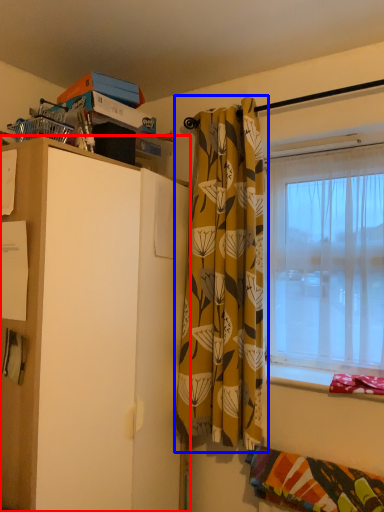
Question: Which point is closer to the camera, cabinetry (highlighted by a red box) or curtain (highlighted by a blue box)?

Choices:
 (A) cabinetry
 (B) curtain

Answer: (A)